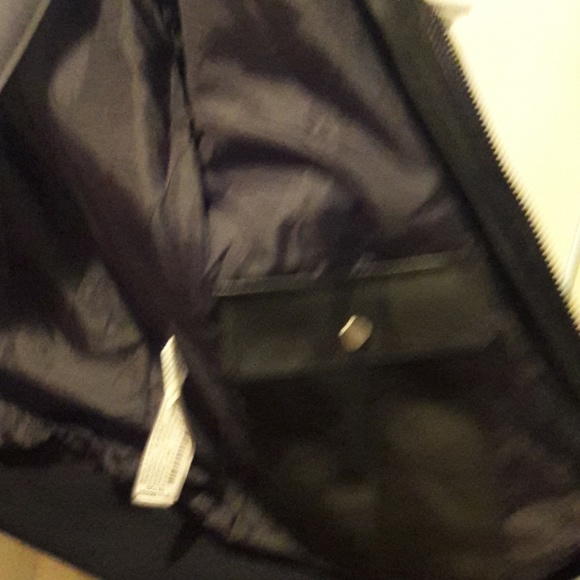
Where is `wall`? wall is located at coordinates (543, 130).